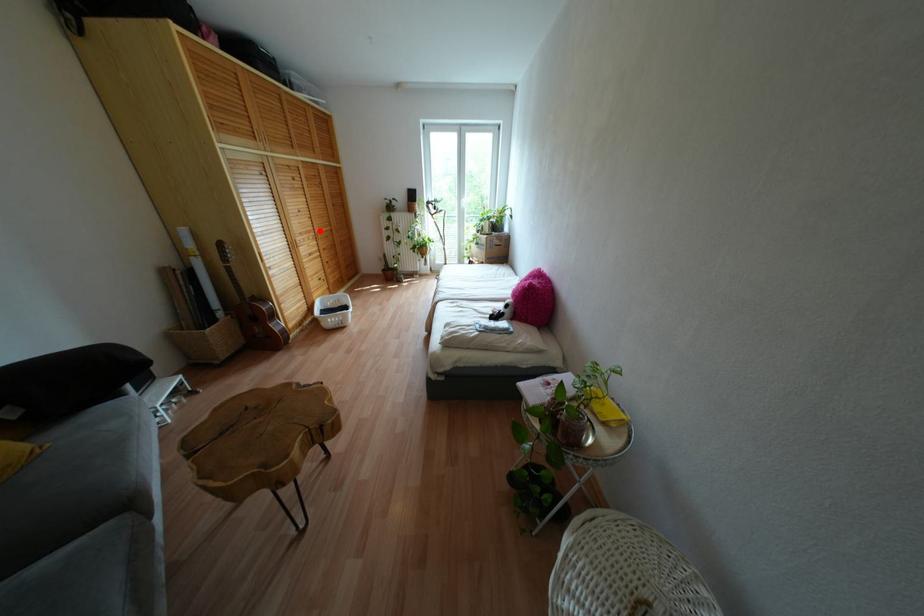
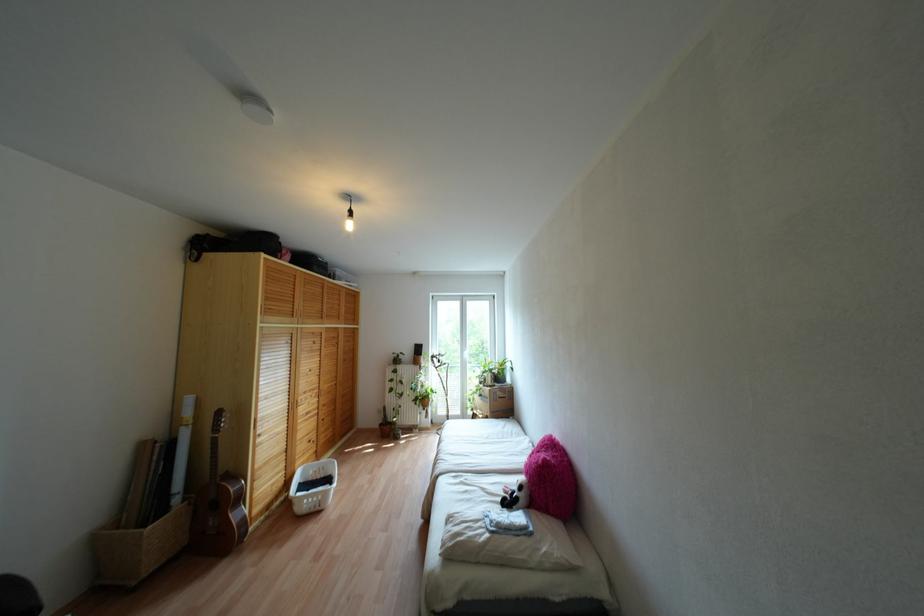
The point at the highlighted location is marked in the first image. Where is the corresponding point in the second image?

(324, 387)